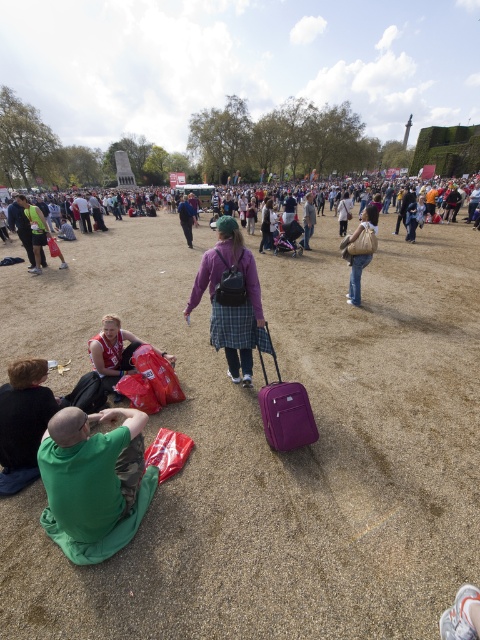
Question: Can you confirm if plaid skirt at center is wider than beige fabric bag at center?

Choices:
 (A) yes
 (B) no

Answer: (A)

Question: Which point appears closest to the camera in this image?

Choices:
 (A) (97, 499)
 (B) (352, 300)
 (C) (205, 257)
 (D) (468, 572)

Answer: (A)

Question: Is green matte shirt at lower left smaller than beige fabric bag at center?

Choices:
 (A) yes
 (B) no

Answer: (A)

Question: Which object is closer to the camera taking this photo?

Choices:
 (A) beige fabric bag at center
 (B) purple matte suitcase at center
 (C) blue denim jacket at center
 (D) green matte shirt at lower left

Answer: (D)

Question: Estimate the real-world distances between objects in this image. Which object is closer to the purple matte suitcase at center?

Choices:
 (A) blue denim jacket at center
 (B) beige fabric bag at center
 (C) plaid skirt at center
 (D) green matte shirt at lower left

Answer: (C)

Question: Does plaid skirt at center come in front of beige fabric bag at center?

Choices:
 (A) no
 (B) yes

Answer: (B)